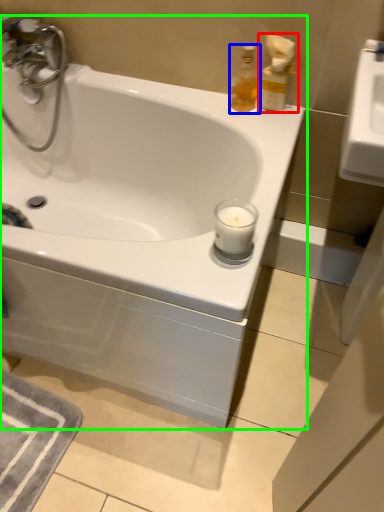
Question: Which is farther away from soap dispenser (highlighted by a red box)? soap dispenser (highlighted by a blue box) or bathtub (highlighted by a green box)?

Choices:
 (A) soap dispenser
 (B) bathtub

Answer: (B)